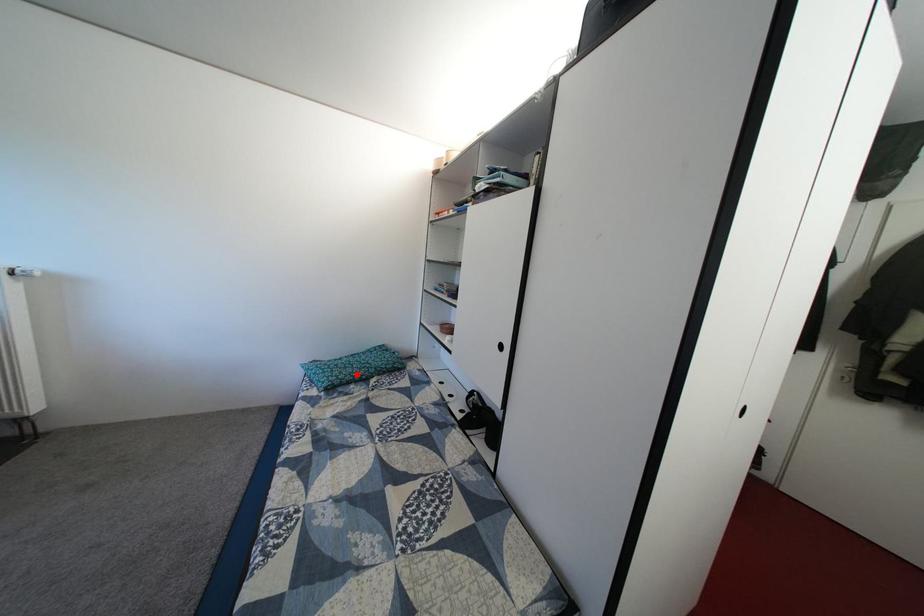
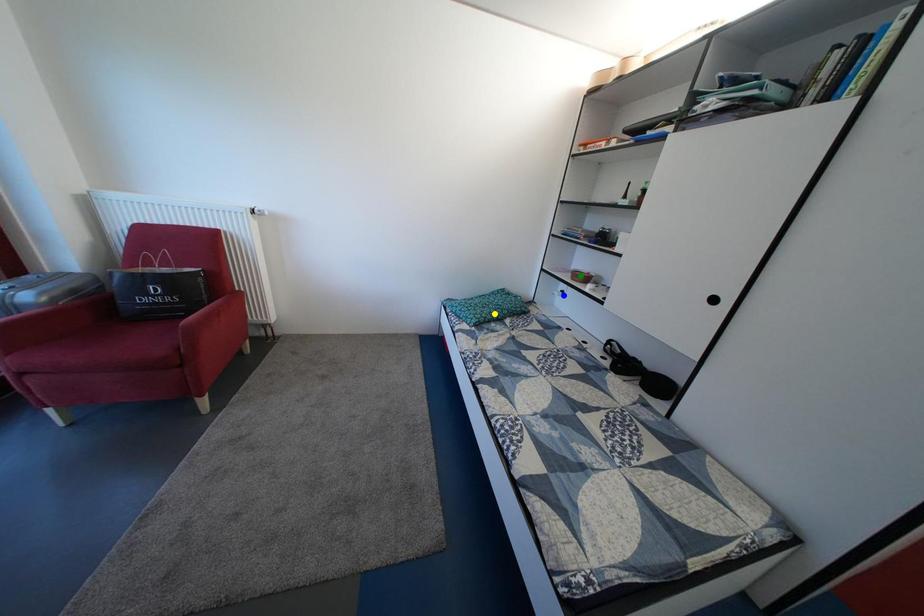
Question: I am providing you with two images of the same scene from different viewpoints. A red point is marked on the first image. You are given multiple points on the second image. Which mark in image 2 goes with the point in image 1?

Choices:
 (A) yellow point
 (B) blue point
 (C) green point

Answer: (A)